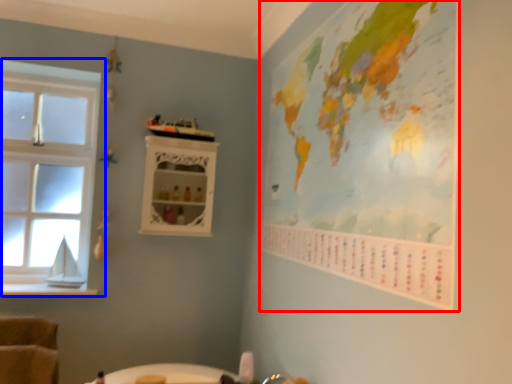
Question: Which point is further to the camera, map (highlighted by a red box) or window (highlighted by a blue box)?

Choices:
 (A) map
 (B) window

Answer: (B)